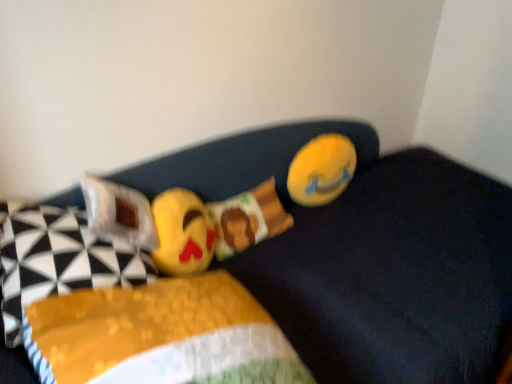
The height and width of the screenshot is (384, 512). Find the location of `free space above soft plush emoji at center, which ranks as the 1th toy in left-to-right order (from a real-world perspective)`. free space above soft plush emoji at center, which ranks as the 1th toy in left-to-right order (from a real-world perspective) is located at coordinates (168, 210).